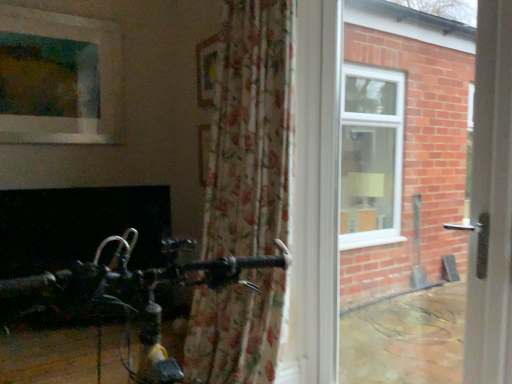
Question: Considering the relative positions of white plastic door handle at right and wooden frame at upper center in the image provided, is white plastic door handle at right behind wooden frame at upper center?

Choices:
 (A) no
 (B) yes

Answer: (A)

Question: Can you confirm if white plastic door handle at right is taller than wooden frame at upper center?

Choices:
 (A) yes
 (B) no

Answer: (A)

Question: Is white plastic door handle at right oriented towards wooden frame at upper center?

Choices:
 (A) yes
 (B) no

Answer: (B)

Question: Does white plastic door handle at right appear on the right side of wooden frame at upper center?

Choices:
 (A) yes
 (B) no

Answer: (A)

Question: From a real-world perspective, is white plastic door handle at right on top of wooden frame at upper center?

Choices:
 (A) no
 (B) yes

Answer: (A)

Question: In terms of height, does wooden frame at upper center look taller or shorter compared to matte glass window at upper left?

Choices:
 (A) short
 (B) tall

Answer: (A)

Question: Based on their sizes in the image, would you say wooden frame at upper center is bigger or smaller than matte glass window at upper left?

Choices:
 (A) small
 (B) big

Answer: (A)

Question: Relative to matte glass window at upper left, is wooden frame at upper center in front or behind?

Choices:
 (A) front
 (B) behind

Answer: (A)

Question: Do you think wooden frame at upper center is within matte glass window at upper left, or outside of it?

Choices:
 (A) outside
 (B) inside

Answer: (A)

Question: Looking at their shapes, would you say white plastic door handle at right is wider or thinner than floral fabric curtain at center?

Choices:
 (A) wide
 (B) thin

Answer: (B)

Question: From a real-world perspective, relative to floral fabric curtain at center, is white plastic door handle at right vertically above or below?

Choices:
 (A) above
 (B) below

Answer: (B)

Question: Considering the positions of white plastic door handle at right and floral fabric curtain at center in the image, is white plastic door handle at right taller or shorter than floral fabric curtain at center?

Choices:
 (A) tall
 (B) short

Answer: (A)

Question: Is white plastic door handle at right in front of or behind floral fabric curtain at center in the image?

Choices:
 (A) behind
 (B) front

Answer: (B)

Question: Considering their positions, is matte glass window at upper left located in front of or behind wooden frame at upper center?

Choices:
 (A) front
 (B) behind

Answer: (B)

Question: From the image's perspective, relative to wooden frame at upper center, is matte glass window at upper left above or below?

Choices:
 (A) above
 (B) below

Answer: (B)